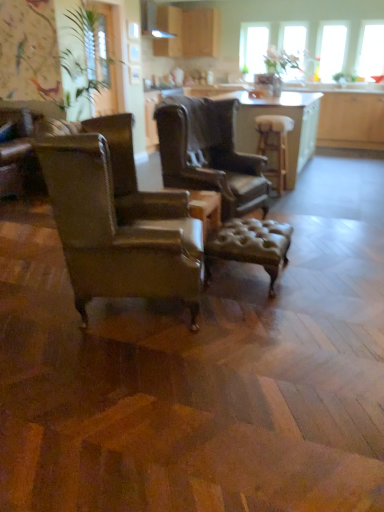
Question: Considering the positions of leather armchair at center, the 1th chair in the back-to-front sequence, and wooden table at center in the image, is leather armchair at center, the 1th chair in the back-to-front sequence, taller or shorter than wooden table at center?

Choices:
 (A) tall
 (B) short

Answer: (A)

Question: Is leather armchair at center, the 2th chair when ordered from front to back, bigger or smaller than wooden table at center?

Choices:
 (A) small
 (B) big

Answer: (A)

Question: Which object is the closest to the transparent glass window at upper right, which is the third window screen from left to right?

Choices:
 (A) leather armchair at left, the 2th chair viewed from the back
 (B) transparent glass window at upper right, the first window screen positioned from the right
 (C) wooden table at center
 (D) wooden cabinet at upper center
 (E) green leafy plant at upper left

Answer: (B)

Question: Estimate the real-world distances between objects in this image. Which object is closer to the transparent glass window at upper right, positioned as the 4th window screen in left-to-right order?

Choices:
 (A) wooden stool at center, arranged as the 2th stool when ordered from the bottom
 (B) transparent glass vase at upper center, positioned as the third window screen in right-to-left order
 (C) wooden table at center
 (D) leather armchair at left, acting as the first chair starting from the front
 (E) leather armchair at center, the 2th chair when ordered from front to back

Answer: (B)